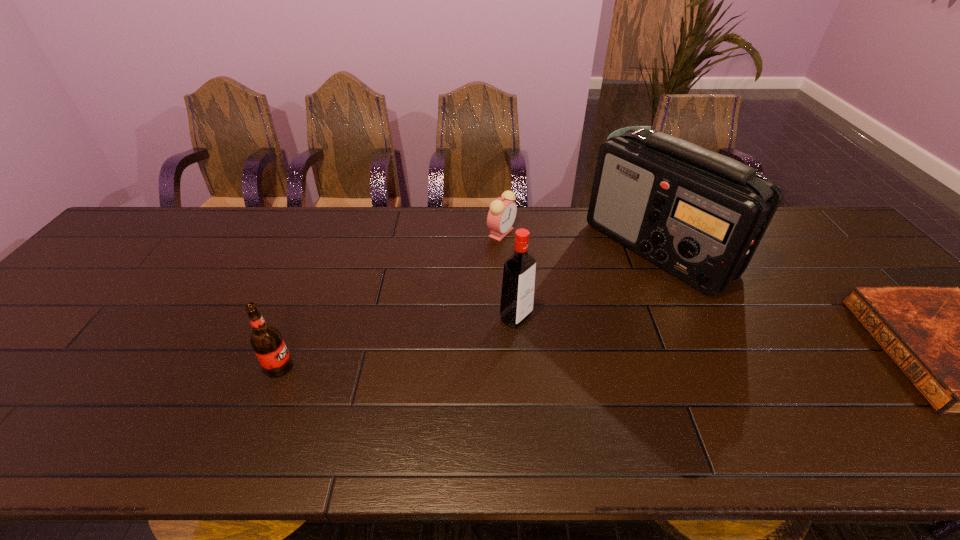
Locate an element on the screen. This screenshot has width=960, height=540. free spot on the desktop that is between the leftmost object and the shortest object and is positioned on the front and back of the fourth shortest object is located at coordinates (586, 360).

The width and height of the screenshot is (960, 540). Find the location of `vacant space on the desktop that is between the leftmost object and the shortest object and is positioned on the front panel of the tallest object`. vacant space on the desktop that is between the leftmost object and the shortest object and is positioned on the front panel of the tallest object is located at coordinates (637, 359).

Identify the location of vacant space on the desktop that is between the third tallest object and the shortest object and is positioned on the face of the second shortest object. (569, 360).